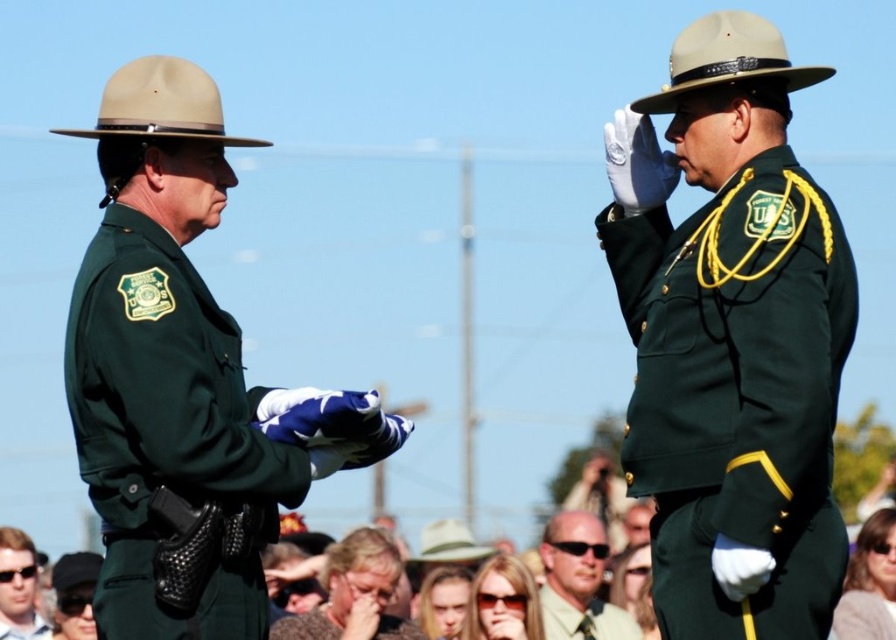
Who is more forward, (x=220, y=412) or (x=314, y=625)?

Point (x=220, y=412) is more forward.

Does green matte uniform at left have a greater height compared to green matte uniform at center?

Yes.

Is point (169, 371) positioned behind point (286, 614)?

No.

At what (x,y) coordinates should I click in order to perform the action: click on green matte uniform at left. Please return your answer as a coordinate pair (x, y). Looking at the image, I should click on (168, 429).

Can you confirm if green matte uniform at right is positioned below matte black sunglasses at lower left?

Actually, green matte uniform at right is above matte black sunglasses at lower left.

Which is above, green matte uniform at right or matte black sunglasses at lower left?

green matte uniform at right

Identify the location of green matte uniform at right. coord(738,394).

Does green matte uniform at right appear on the right side of light brown fabric shirt at center?

Correct, you'll find green matte uniform at right to the right of light brown fabric shirt at center.

The image size is (896, 640). Describe the element at coordinates (738, 394) in the screenshot. I see `green matte uniform at right` at that location.

Where is `green matte uniform at right`? This screenshot has width=896, height=640. green matte uniform at right is located at coordinates (738, 394).

What are the coordinates of `green matte uniform at right` in the screenshot? It's located at (738, 394).